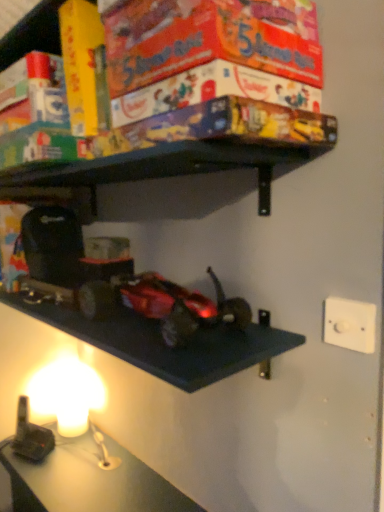
Question: Do you think shiny metallic car at center is within white plastic/light switch at upper right, or outside of it?

Choices:
 (A) outside
 (B) inside

Answer: (A)

Question: In terms of size, does shiny metallic car at center appear bigger or smaller than white plastic/light switch at upper right?

Choices:
 (A) small
 (B) big

Answer: (B)

Question: From a real-world perspective, is shiny metallic car at center positioned above or below white plastic/light switch at upper right?

Choices:
 (A) above
 (B) below

Answer: (A)

Question: Visually, is white plastic/light switch at upper right positioned to the left or to the right of shiny metallic car at center?

Choices:
 (A) right
 (B) left

Answer: (A)

Question: Does point (375, 306) appear closer or farther from the camera than point (213, 313)?

Choices:
 (A) farther
 (B) closer

Answer: (B)

Question: In terms of size, does white plastic/light switch at upper right appear bigger or smaller than shiny metallic car at center?

Choices:
 (A) big
 (B) small

Answer: (B)

Question: In terms of width, does white plastic/light switch at upper right look wider or thinner when compared to shiny metallic car at center?

Choices:
 (A) wide
 (B) thin

Answer: (B)